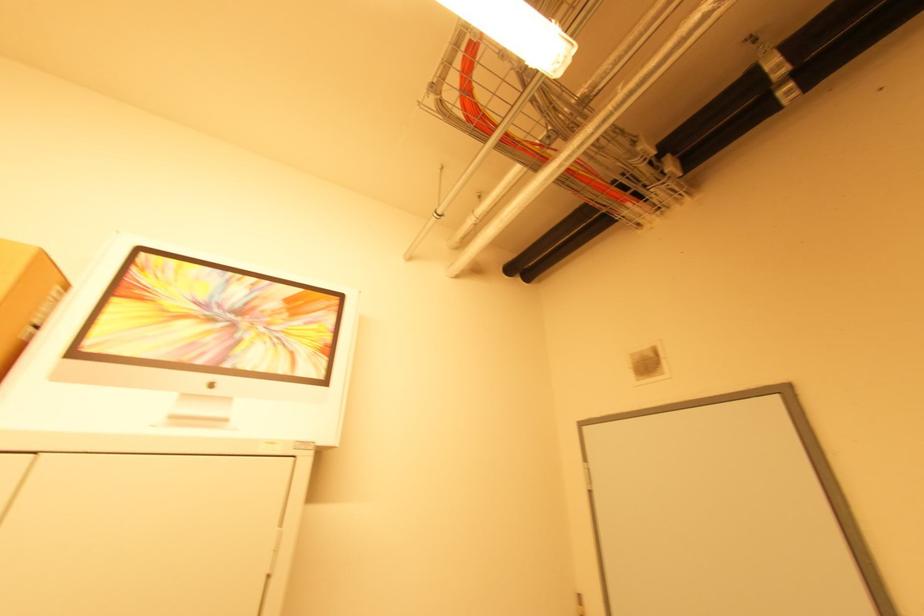
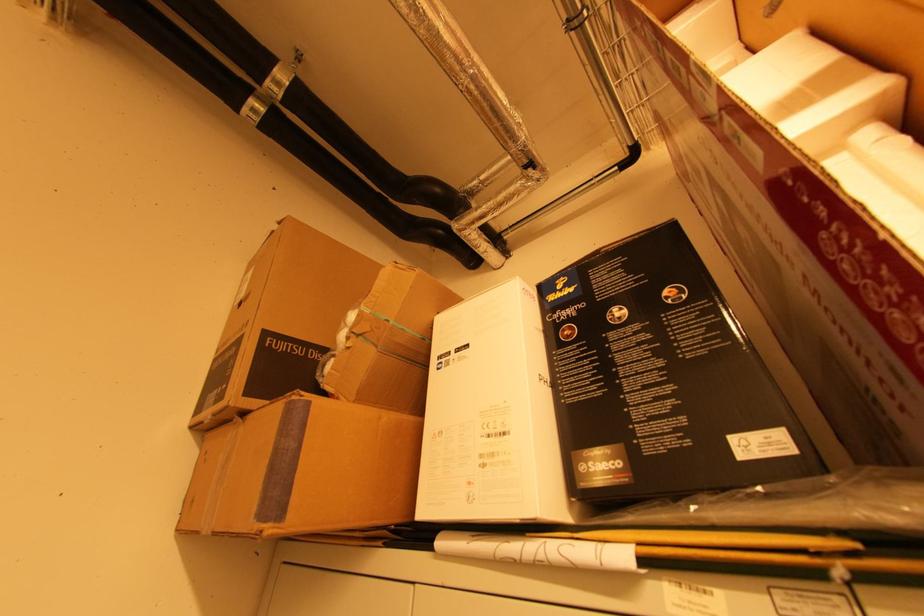
The images are taken continuously from a first-person perspective. In which direction is your viewpoint rotating?

The camera rotated toward right-up.